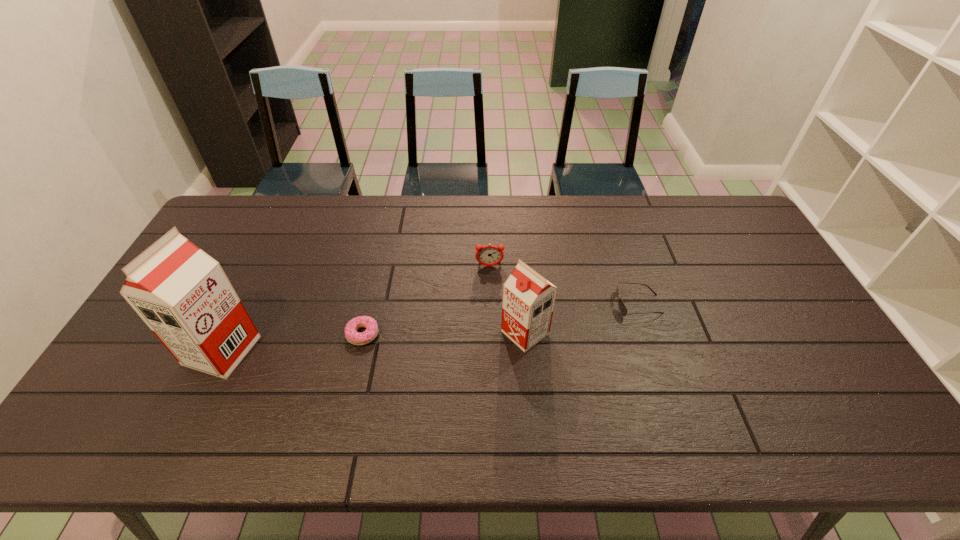
Locate an element on the screen. The width and height of the screenshot is (960, 540). free spot between the tallest object and the fourth tallest object is located at coordinates (430, 327).

This screenshot has width=960, height=540. Identify the location of free space between the shortest object and the second shortest object. (500, 319).

The image size is (960, 540). I want to click on vacant area that lies between the sunglasses and the taller soya milk, so click(430, 327).

Find the location of a particular element. The height and width of the screenshot is (540, 960). the second closest object to the doughnut is located at coordinates (528, 298).

At what (x,y) coordinates should I click in order to perform the action: click on object that is the fourth closest to the second shortest object. Please return your answer as a coordinate pair (x, y). Looking at the image, I should click on (183, 295).

Locate an element on the screen. The width and height of the screenshot is (960, 540). vacant space that satisfies the following two spatial constraints: 1. on the back side of the doughnut; 2. on the right side of the shorter soya milk is located at coordinates (363, 333).